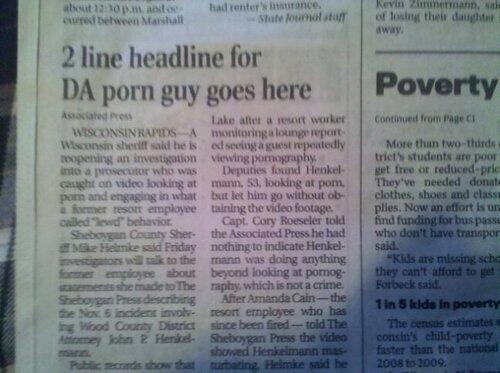
Identify the location of newspaper. (333, 85).